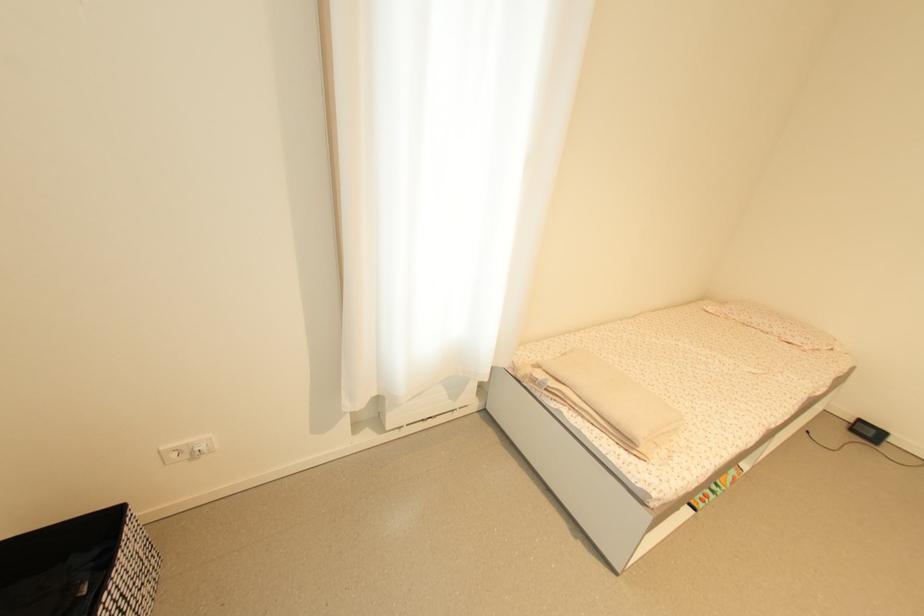
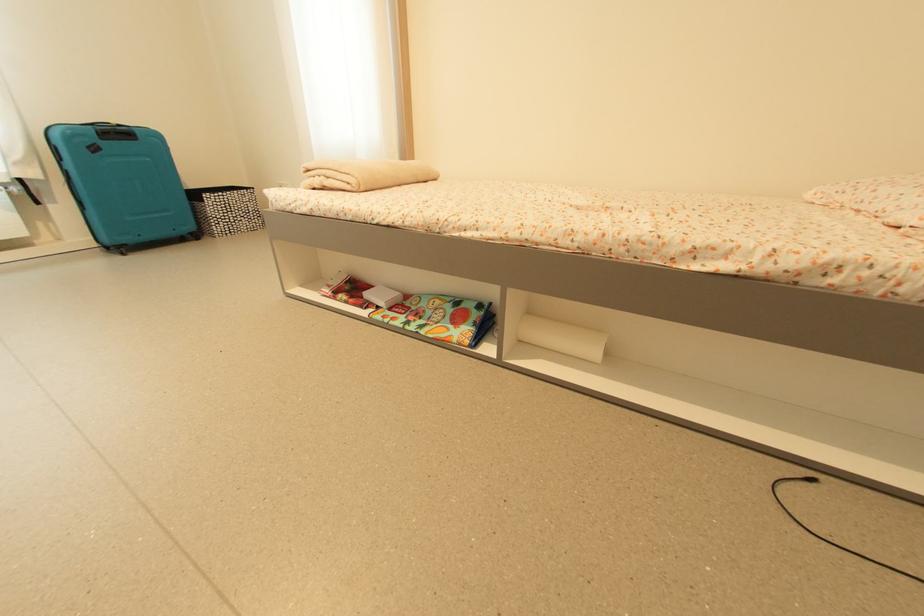
Locate, in the second image, the point that corresponds to pixel 736 482 in the first image.

(447, 337)